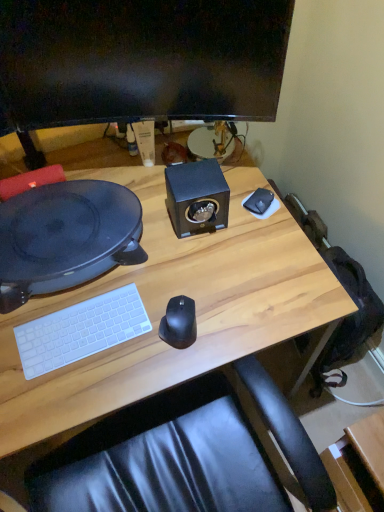
Question: From their relative heights in the image, would you say black matte mouse at center is taller or shorter than white matte mousepad at upper right?

Choices:
 (A) short
 (B) tall

Answer: (B)

Question: Considering the positions of point (163, 317) and point (253, 215), is point (163, 317) closer or farther from the camera than point (253, 215)?

Choices:
 (A) farther
 (B) closer

Answer: (B)

Question: Which of these objects is positioned farthest from the white matte mousepad at upper right?

Choices:
 (A) matte black monitor at upper center
 (B) black matte mouse at center
 (C) black plastic record player at left
 (D) wooden desk at center
 (E) black matte speaker at center

Answer: (C)

Question: Which of these objects is positioned closest to the white matte mousepad at upper right?

Choices:
 (A) black plastic record player at left
 (B) matte black monitor at upper center
 (C) black matte mouse at center
 (D) white matte keyboard at lower left
 (E) black matte speaker at center

Answer: (E)